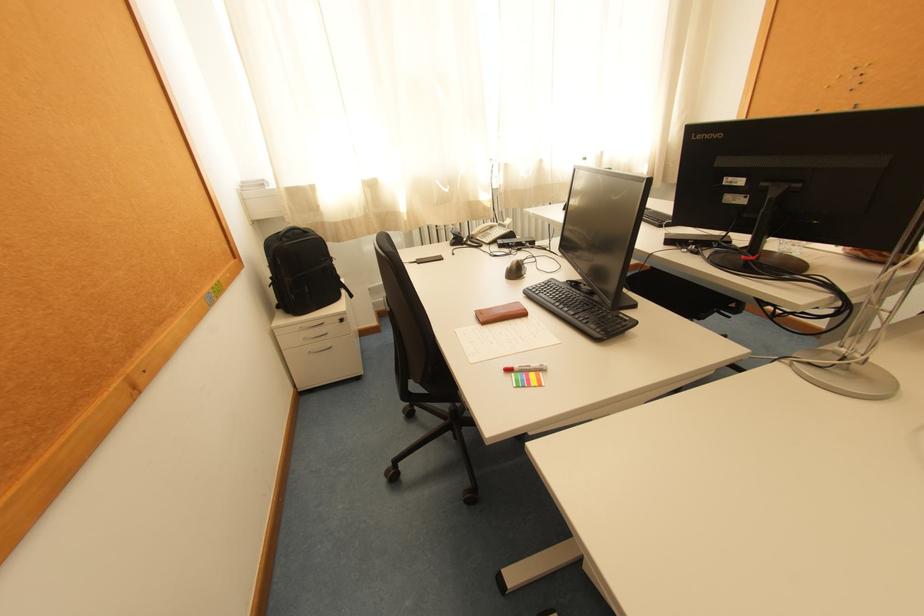
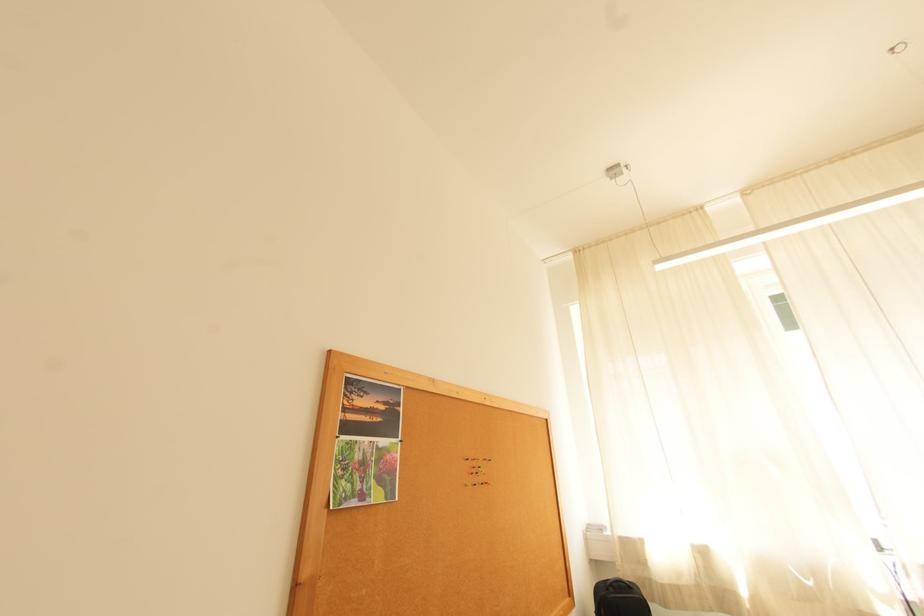
The images are taken continuously from a first-person perspective. In which direction is your viewpoint rotating?

The camera's rotation is toward left-up.